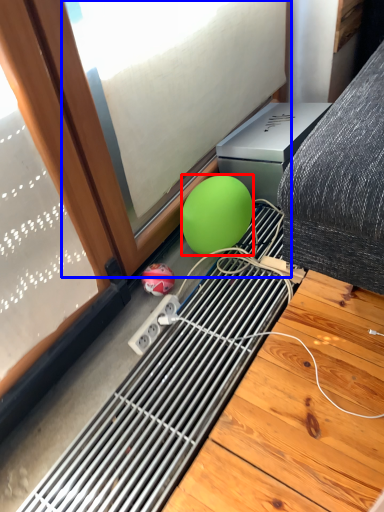
Question: Which point is closer to the camera, ball (highlighted by a red box) or window (highlighted by a blue box)?

Choices:
 (A) ball
 (B) window

Answer: (B)